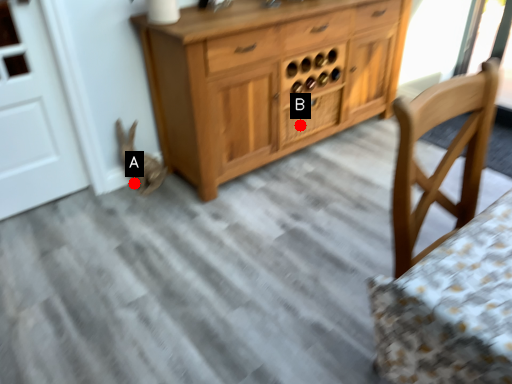
Question: Two points are circled on the image, labeled by A and B beside each circle. Which point appears farthest from the camera in this image?

Choices:
 (A) A is further
 (B) B is further

Answer: (B)